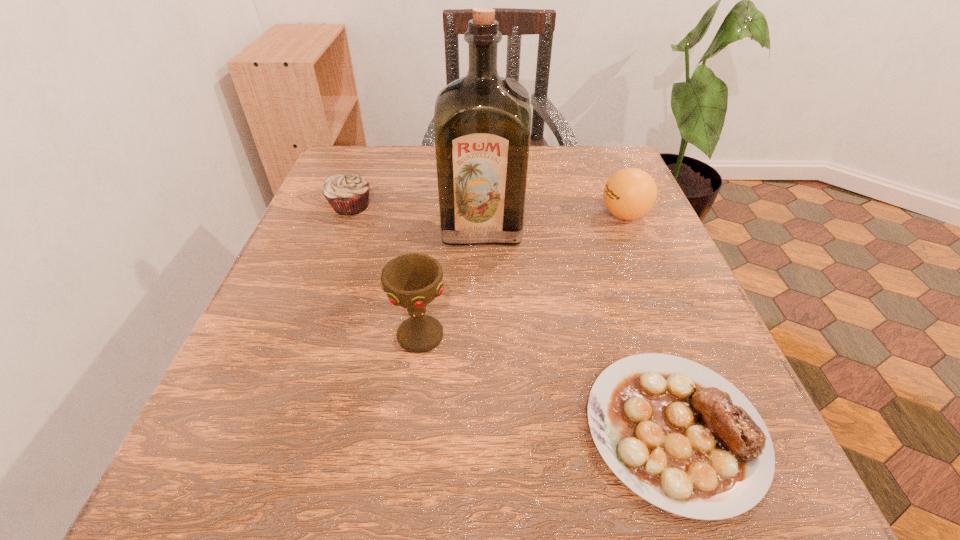
Image resolution: width=960 pixels, height=540 pixels. In order to click on the tallest object in this screenshot , I will do `click(482, 122)`.

You are a GUI agent. You are given a task and a screenshot of the screen. Output one action in this format:
    pyautogui.click(x=<x>, y=<y>)
    Task: Click on the chalice
    
    Given the screenshot: What is the action you would take?
    pyautogui.click(x=412, y=281)

The image size is (960, 540). I want to click on ping-pong ball, so click(630, 193).

I want to click on the second shortest object, so click(347, 194).

Locate an element on the screen. muffin is located at coordinates (347, 194).

Image resolution: width=960 pixels, height=540 pixels. Find the location of `the shortest object`. the shortest object is located at coordinates (679, 435).

Image resolution: width=960 pixels, height=540 pixels. Find the location of `blank area located on the label of the tallest object`. blank area located on the label of the tallest object is located at coordinates coord(483,371).

Locate an element on the screen. vacant region located on the right of the fourth shortest object is located at coordinates (519, 335).

Identify the location of free space located 0.100m on the side with brand of the third tallest object. This screenshot has width=960, height=540. (551, 215).

At what (x,y) coordinates should I click in order to perform the action: click on vacant area situated 0.050m on the side with brand of the third tallest object. Please return your answer as a coordinate pair (x, y). The image size is (960, 540). Looking at the image, I should click on (575, 215).